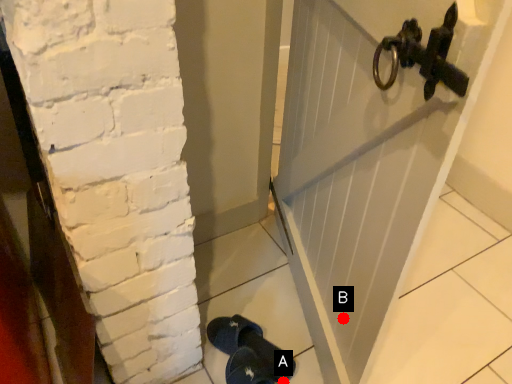
Question: Two points are circled on the image, labeled by A and B beside each circle. Which point is closer to the camera taking this photo?

Choices:
 (A) A is closer
 (B) B is closer

Answer: (B)